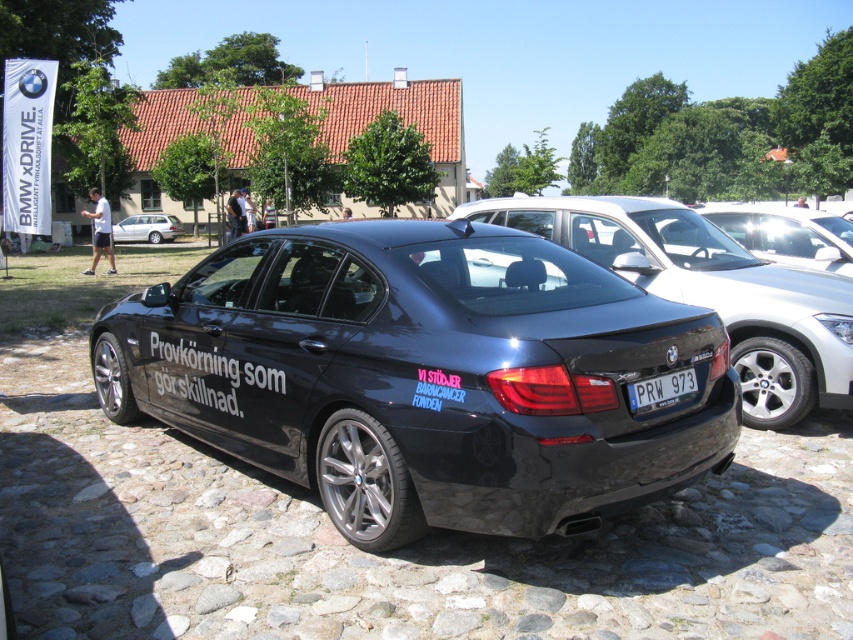
Question: From the image, what is the correct spatial relationship of glossy black sedan at center in relation to glossy black car at center?

Choices:
 (A) left
 (B) right

Answer: (A)

Question: Which point is closer to the camera?

Choices:
 (A) (480, 529)
 (B) (685, 378)
 (C) (680, 225)
 (D) (154, 218)

Answer: (A)

Question: In this image, where is glossy black sedan at center located relative to silver metallic hatchback at center?

Choices:
 (A) left
 (B) right

Answer: (B)

Question: Which of the following is the farthest from the observer?

Choices:
 (A) (393, 541)
 (B) (157, 216)

Answer: (B)

Question: Which object is closer to the camera taking this photo?

Choices:
 (A) glossy black sedan at center
 (B) glossy black car at center

Answer: (A)

Question: Observing the image, what is the correct spatial positioning of glossy black car at center in reference to white plastic license plate at center?

Choices:
 (A) right
 (B) left

Answer: (A)